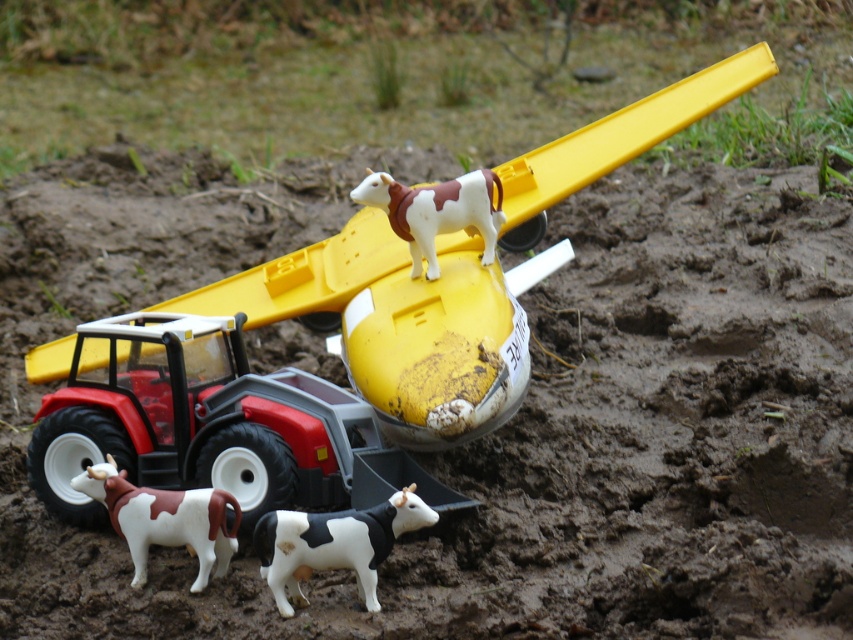
Question: Considering the real-world distances, which object is closest to the brown and white plastic cow at lower left?

Choices:
 (A) yellow plastic airplane at center
 (B) brown and white plastic cow at upper center

Answer: (A)

Question: Is black and white plastic cow at lower center smaller than brown and white plastic cow at lower left?

Choices:
 (A) yes
 (B) no

Answer: (A)

Question: Is yellow plastic airplane at center wider than black and white plastic cow at lower center?

Choices:
 (A) yes
 (B) no

Answer: (A)

Question: Does black and white plastic cow at lower center have a smaller size compared to brown and white plastic cow at upper center?

Choices:
 (A) yes
 (B) no

Answer: (B)

Question: Which point is farther to the camera?

Choices:
 (A) (370, 189)
 (B) (373, 600)

Answer: (A)

Question: Which point is farther to the camera?

Choices:
 (A) (485, 220)
 (B) (370, 248)
 (C) (177, 497)
 (D) (329, 541)

Answer: (B)